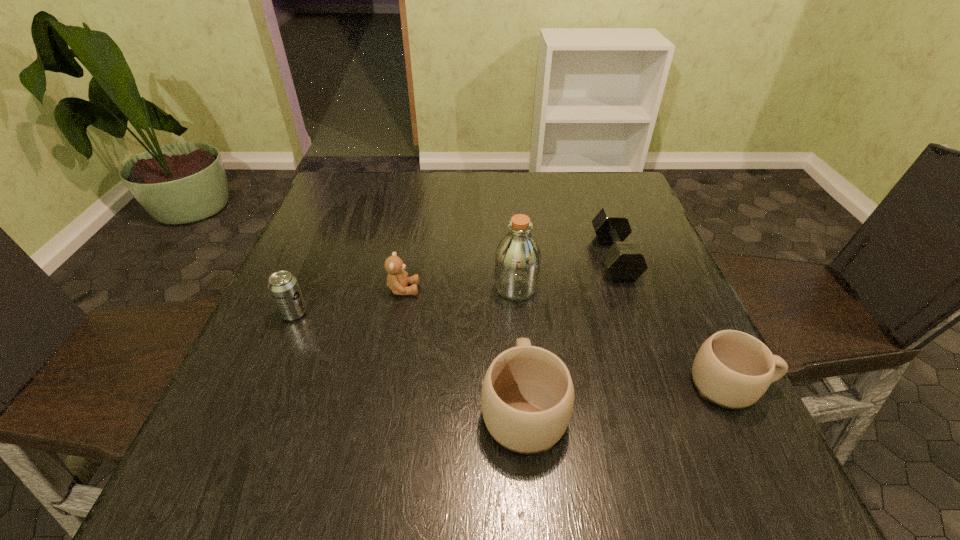
The image size is (960, 540). Identify the location of vacant space located 0.140m on the side of the left mug with the handle. (516, 309).

Locate an element on the screen. vacant position located on the front of the tallest object is located at coordinates (519, 323).

This screenshot has width=960, height=540. I want to click on vacant space located 0.300m on the face of the teddy bear, so coord(555,289).

At what (x,y) coordinates should I click in order to perform the action: click on vacant position located on the front of the fourth farthest object. Please return your answer as a coordinate pair (x, y). This screenshot has width=960, height=540. Looking at the image, I should click on (259, 395).

Locate an element on the screen. This screenshot has height=540, width=960. free space located 0.160m on the back of the dumbbell is located at coordinates (594, 201).

I want to click on object present at the left edge, so click(283, 286).

What are the coordinates of `mug located in the right edge section of the desktop` in the screenshot? It's located at coord(732,369).

The image size is (960, 540). I want to click on dumbbell positioned at the right edge, so click(x=625, y=262).

Where is `object at the near right corner`? This screenshot has height=540, width=960. object at the near right corner is located at coordinates (732, 369).

The width and height of the screenshot is (960, 540). I want to click on vacant region at the far edge of the desktop, so click(464, 200).